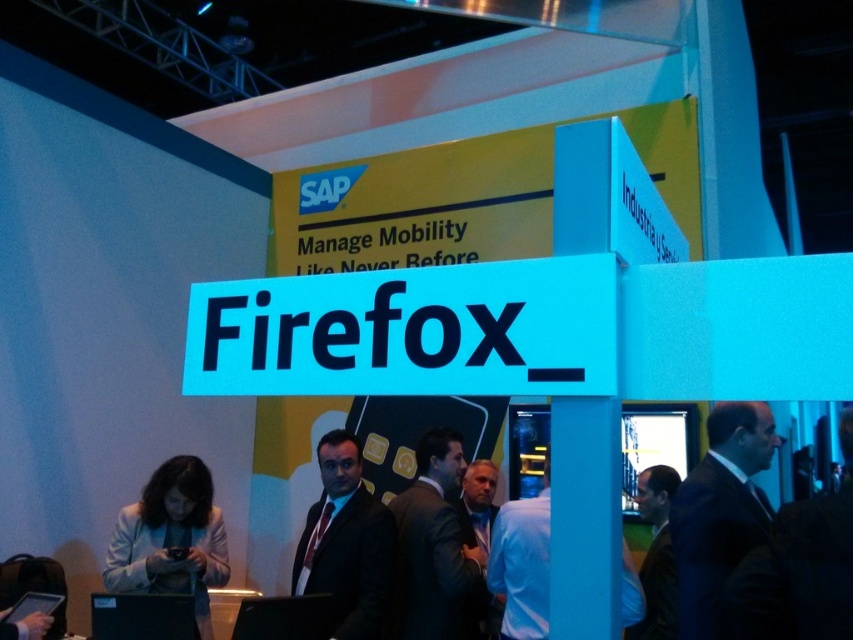
Can you confirm if dark brown suit at center is bigger than blue fabric shirt at center?

Indeed, dark brown suit at center has a larger size compared to blue fabric shirt at center.

Between dark brown suit at center and blue fabric shirt at center, which one appears on the right side from the viewer's perspective?

Positioned to the right is blue fabric shirt at center.

Is point (428, 500) positioned in front of point (621, 573)?

No, (428, 500) is behind (621, 573).

Where is `dark brown suit at center`? Image resolution: width=853 pixels, height=640 pixels. dark brown suit at center is located at coordinates (434, 547).

Does dark suit at center have a lesser height compared to blue fabric shirt at center?

In fact, dark suit at center may be taller than blue fabric shirt at center.

Is point (354, 497) in front of point (498, 538)?

Yes, point (354, 497) is in front of point (498, 538).

Is point (346, 634) closer to camera compared to point (526, 621)?

Yes, point (346, 634) is closer to viewer.

Locate an element on the screen. The image size is (853, 640). dark suit at center is located at coordinates (347, 544).

Between dark suit at center and light beige blazer at lower left, which one has less height?

Standing shorter between the two is light beige blazer at lower left.

Does point (343, 637) come farther from viewer compared to point (175, 464)?

No, (343, 637) is in front of (175, 464).

Is point (369, 509) less distant than point (129, 536)?

Yes, point (369, 509) is closer to viewer.

Where is `dark suit at center`? The width and height of the screenshot is (853, 640). dark suit at center is located at coordinates (347, 544).